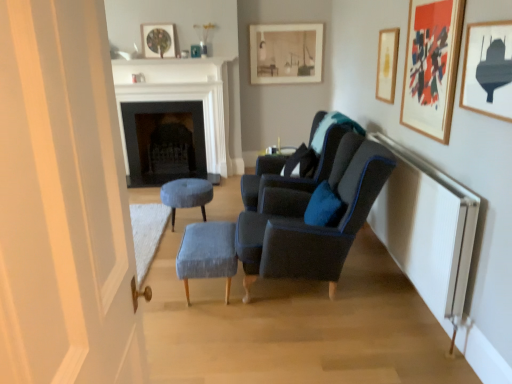
Identify the location of vacant space situated above light blue fabric stool at center, which is counted as the 2th stool, starting from the back (from a real-world perspective). (211, 234).